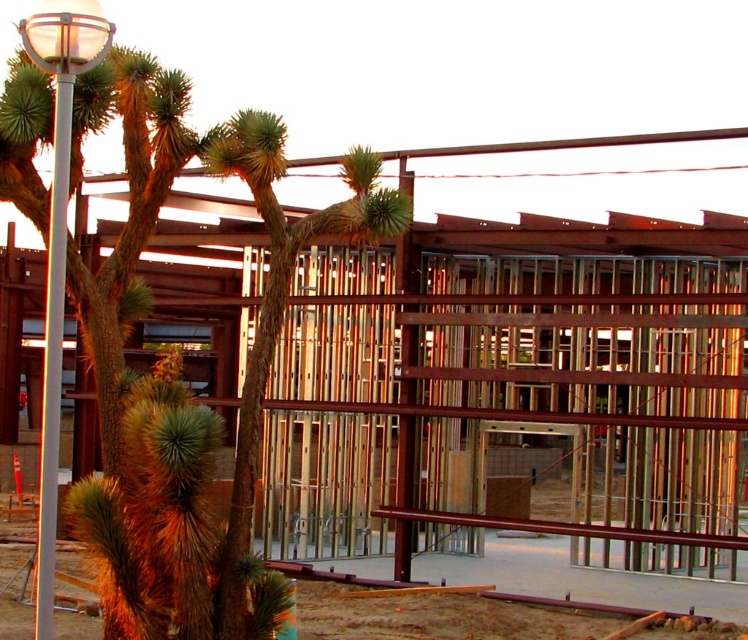
You are a delivery person trying to park your van between the white glossy lamp post at left and the white glossy pole at left. The van is 2 meters long. Can you fit it there?

The white glossy lamp post at left and the white glossy pole at left are 86.04 centimeters apart. Since the van is 2 meters long, which is longer than the space between them, you cannot fit the van there.

You are a delivery person trying to navigate through the construction site. You need to deliver a package to the area near the green spiky palm tree at center. From your current position near the white glossy lamp post at left, which direction should you move to reach the palm tree?

The green spiky palm tree at center is positioned on the right side of the white glossy lamp post at left. Therefore, you should move to the right to reach the palm tree.